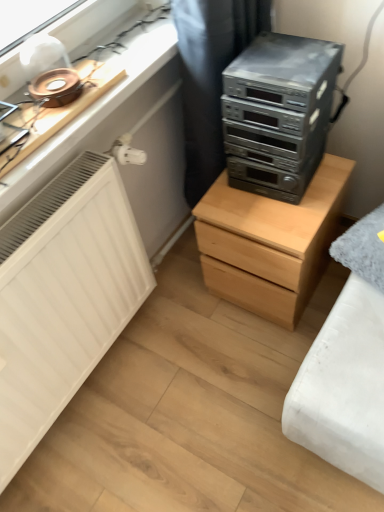
Question: Is satin black stereo at upper right in contact with light wood chest of drawers at center?

Choices:
 (A) yes
 (B) no

Answer: (B)

Question: Can you confirm if satin black stereo at upper right is wider than light wood chest of drawers at center?

Choices:
 (A) no
 (B) yes

Answer: (A)

Question: Does satin black stereo at upper right appear on the right side of light wood chest of drawers at center?

Choices:
 (A) yes
 (B) no

Answer: (B)

Question: Is satin black stereo at upper right positioned far away from light wood chest of drawers at center?

Choices:
 (A) no
 (B) yes

Answer: (A)

Question: From the image's perspective, is satin black stereo at upper right above light wood chest of drawers at center?

Choices:
 (A) yes
 (B) no

Answer: (A)

Question: Considering the relative positions of satin black stereo at upper right and light wood chest of drawers at center in the image provided, is satin black stereo at upper right behind light wood chest of drawers at center?

Choices:
 (A) yes
 (B) no

Answer: (B)

Question: Can you confirm if black fabric curtain at upper center is taller than light wood chest of drawers at center?

Choices:
 (A) yes
 (B) no

Answer: (A)

Question: Is black fabric curtain at upper center in contact with light wood chest of drawers at center?

Choices:
 (A) no
 (B) yes

Answer: (A)

Question: Does black fabric curtain at upper center appear on the right side of light wood chest of drawers at center?

Choices:
 (A) no
 (B) yes

Answer: (A)

Question: Could you tell me if black fabric curtain at upper center is facing light wood chest of drawers at center?

Choices:
 (A) yes
 (B) no

Answer: (A)

Question: From a real-world perspective, is black fabric curtain at upper center physically below light wood chest of drawers at center?

Choices:
 (A) yes
 (B) no

Answer: (B)

Question: From the image's perspective, is black fabric curtain at upper center located beneath light wood chest of drawers at center?

Choices:
 (A) no
 (B) yes

Answer: (A)

Question: Is satin black stereo at upper right located within black fabric curtain at upper center?

Choices:
 (A) no
 (B) yes

Answer: (A)